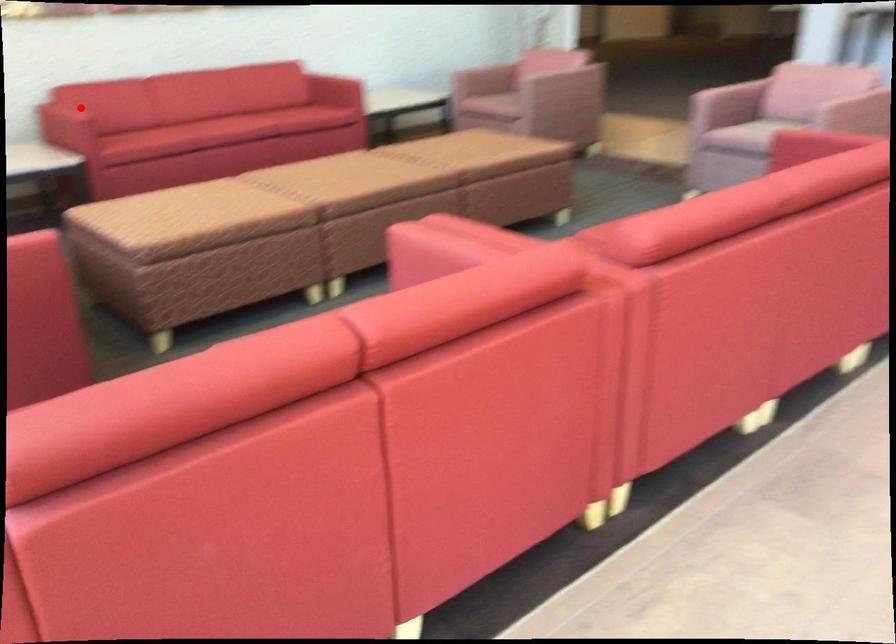
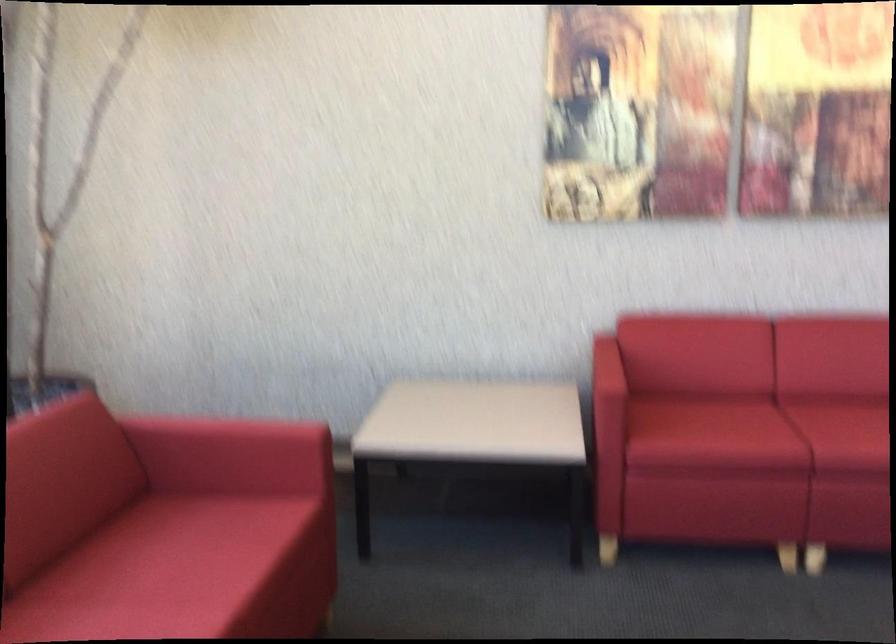
In the second image, find the point that corresponds to the highlighted location in the first image.

(607, 377)